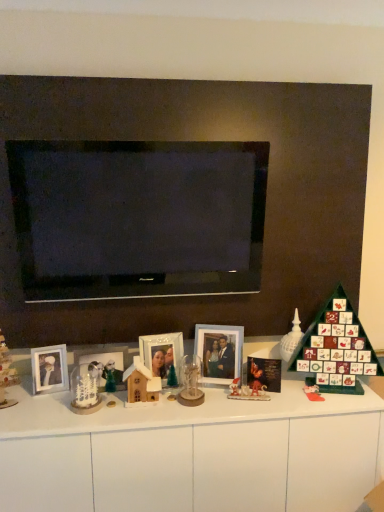
Locate an element on the screen. This screenshot has width=384, height=512. vacant region to the left of matte plastic toy at right, which is counted as the second toy, starting from the front is located at coordinates (283, 397).